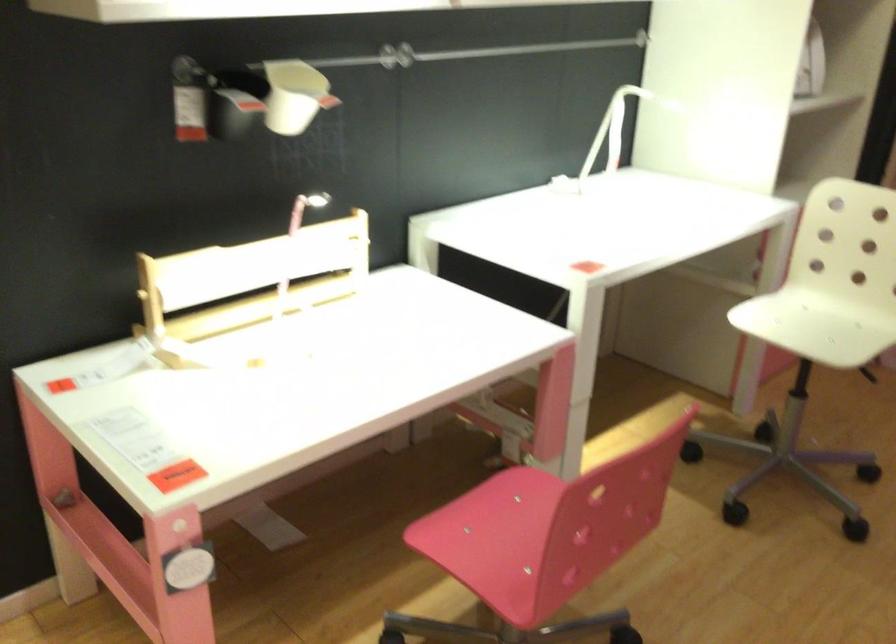
Where is `white chair sitting surface`? The width and height of the screenshot is (896, 644). white chair sitting surface is located at coordinates (812, 327).